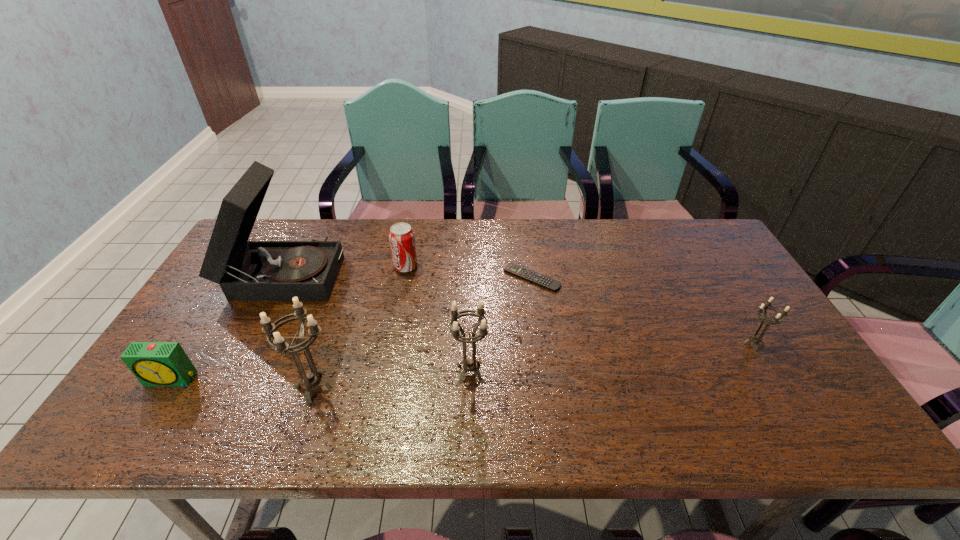
Locate an element on the screen. The image size is (960, 540). vacant space located on the right of the leftmost candle holder is located at coordinates (388, 388).

Where is `vacant position located 0.180m on the right of the third object from right to left`? The height and width of the screenshot is (540, 960). vacant position located 0.180m on the right of the third object from right to left is located at coordinates (563, 373).

This screenshot has width=960, height=540. I want to click on vacant area situated on the back of the rightmost object, so click(x=731, y=307).

You are a GUI agent. You are given a task and a screenshot of the screen. Output one action in this format:
    pyautogui.click(x=<x>, y=<y>)
    Task: Click on the vacant space located 0.080m on the logo side of the fourth object from left to right
    
    Given the screenshot: What is the action you would take?
    pyautogui.click(x=444, y=267)

Locate an element on the screen. The image size is (960, 540). vacant space located on the front-facing side of the tallest object is located at coordinates (427, 272).

What are the coordinates of `free region located 0.230m on the front of the sixth object from left to right` in the screenshot? It's located at (542, 354).

The image size is (960, 540). What are the coordinates of `soda can that is positioned at the far edge` in the screenshot? It's located at (401, 236).

Where is `phonograph_record at the far edge`? The image size is (960, 540). phonograph_record at the far edge is located at coordinates (246, 270).

You are a GUI agent. You are given a task and a screenshot of the screen. Output one action in this format:
    pyautogui.click(x=<x>, y=<y>)
    Task: Click on the alarm clock present at the near edge
    The width and height of the screenshot is (960, 540).
    Given the screenshot: What is the action you would take?
    pyautogui.click(x=153, y=363)

Locate an element on the screen. phonograph_record that is at the left edge is located at coordinates (246, 270).